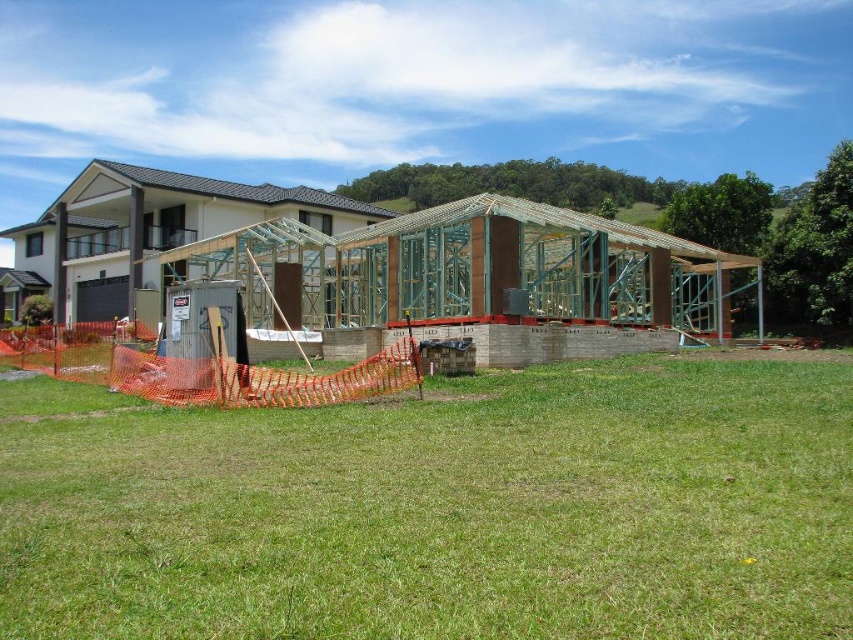
You are a delivery truck driver who needs to deliver materials to the construction site. Your truck is 15 meters long. You are currently positioned at the green grass at center. Can you safely maneuver your truck to the wooden frame house under construction at center without exceeding the available space?

The distance between the green grass at center and the wooden frame house under construction at center is 15.41 meters. Since your truck is 15 meters long, there is enough space to maneuver safely as the distance is slightly longer than the truck.

From the picture: You are a construction worker standing at the point marked by the coordinates [439,508]. What surface are you standing on?

The point at coordinates [439,508] corresponds to the green grass at center, so you are standing on the green grass at center.

Looking at this image, you are a construction worker who needs to determine the space available for equipment storage. Which area is narrower between the green grass at center and the wooden frame house under construction at center?

The green grass at center has a lesser width compared to the wooden frame house under construction at center, so the green grass at center is narrower.